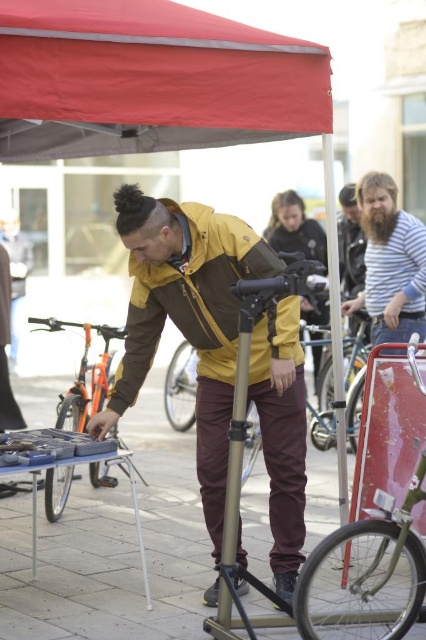
Between point (106, 408) and point (198, 262), which one is positioned in front?

Point (198, 262) is in front.

Who is positioned more to the right, matte yellow jacket at center or brown matte jacket at center?

Positioned to the right is brown matte jacket at center.

Is point (152, 236) in front of point (209, 376)?

Yes, it is in front of point (209, 376).

Identify the location of matte yellow jacket at center. This screenshot has width=426, height=640. (187, 317).

Is red fabric canopy at upper center above orange matte bicycle at left?

Yes.

Where is `red fabric canopy at upper center`? The height and width of the screenshot is (640, 426). red fabric canopy at upper center is located at coordinates (149, 80).

Between maroon fabric pants at center and striped fabric shirt at upper right, which one appears on the right side from the viewer's perspective?

From the viewer's perspective, striped fabric shirt at upper right appears more on the right side.

Does maroon fabric pants at center appear on the right side of striped fabric shirt at upper right?

In fact, maroon fabric pants at center is to the left of striped fabric shirt at upper right.

Between point (51, 595) and point (368, 195), which one is positioned behind?

The point (368, 195) is behind.

Where is `maroon fabric pants at center`? maroon fabric pants at center is located at coordinates (112, 547).